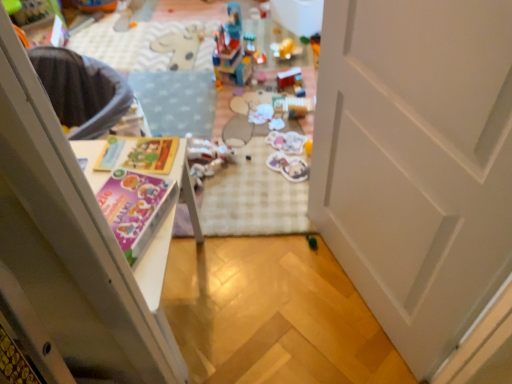
Locate an element on the screen. empty space that is ontop of matte purple book at left (from a real-world perspective) is located at coordinates (124, 200).